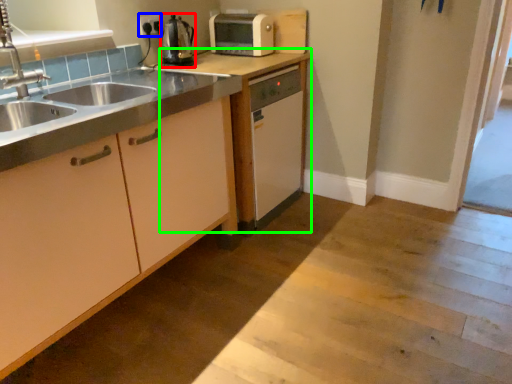
Question: Estimate the real-world distances between objects in this image. Which object is farther from kitchen appliance (highlighted by a red box), electric outlet (highlighted by a blue box) or cabinetry (highlighted by a green box)?

Choices:
 (A) electric outlet
 (B) cabinetry

Answer: (B)